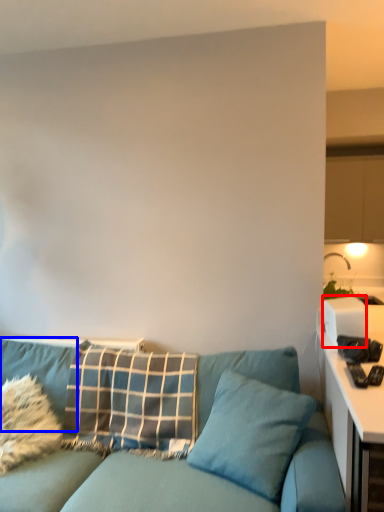
Question: Which of the following is the closest to the observer, appliance (highlighted by a red box) or pillow (highlighted by a blue box)?

Choices:
 (A) appliance
 (B) pillow

Answer: (B)